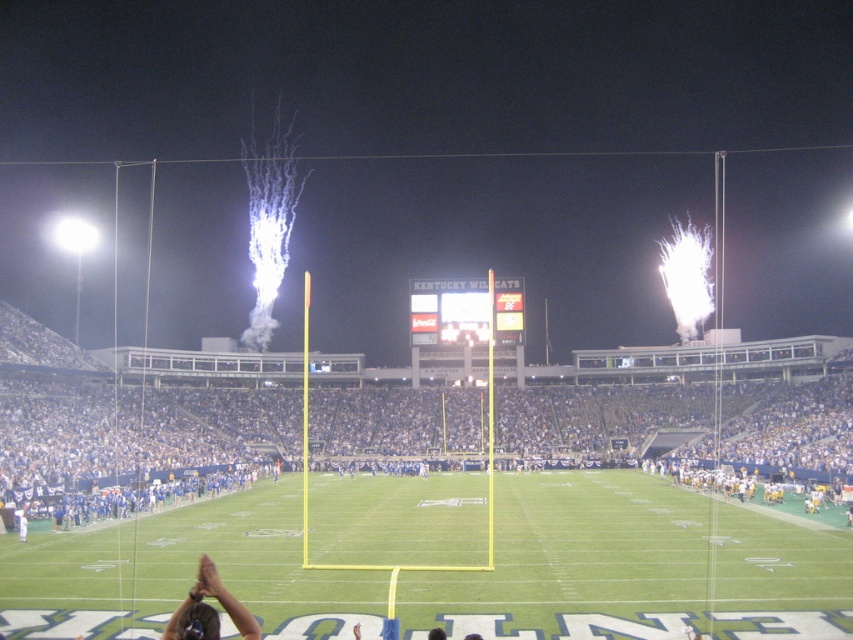
Question: Which point is closer to the camera?

Choices:
 (A) (190, 593)
 (B) (338, 493)

Answer: (A)

Question: Which object appears closest to the camera in this image?

Choices:
 (A) green artificial turf at center
 (B) dark brown hair at lower left

Answer: (B)

Question: Does green artificial turf at center appear under dark brown hair at lower left?

Choices:
 (A) no
 (B) yes

Answer: (B)

Question: Considering the relative positions of green artificial turf at center and dark brown hair at lower left in the image provided, where is green artificial turf at center located with respect to dark brown hair at lower left?

Choices:
 (A) left
 (B) right

Answer: (B)

Question: Where is green artificial turf at center located in relation to dark brown hair at lower left in the image?

Choices:
 (A) right
 (B) left

Answer: (A)

Question: Which object is farther from the camera taking this photo?

Choices:
 (A) dark brown hair at lower left
 (B) green artificial turf at center

Answer: (B)